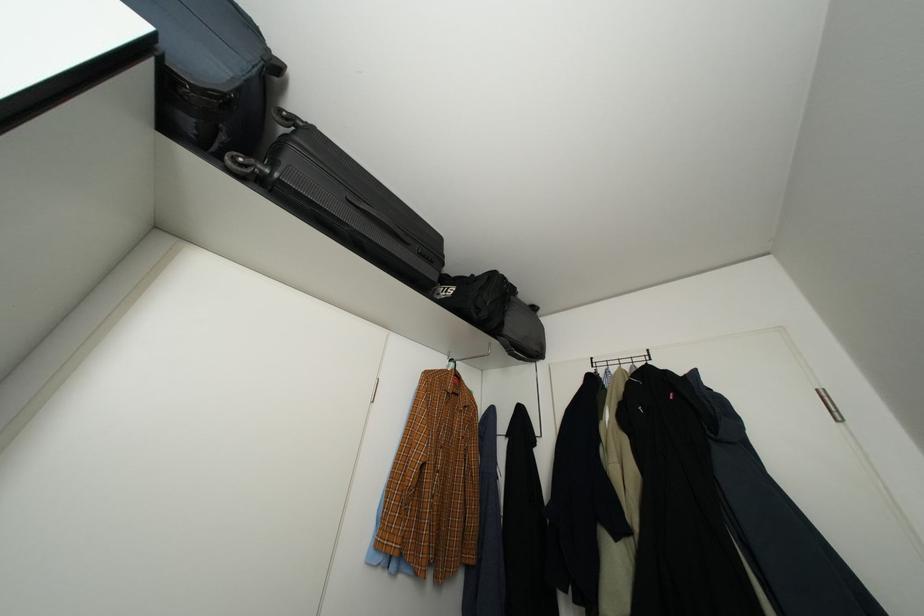
Locate an element on the screen. This screenshot has width=924, height=616. black suitcase handle is located at coordinates (345, 200).